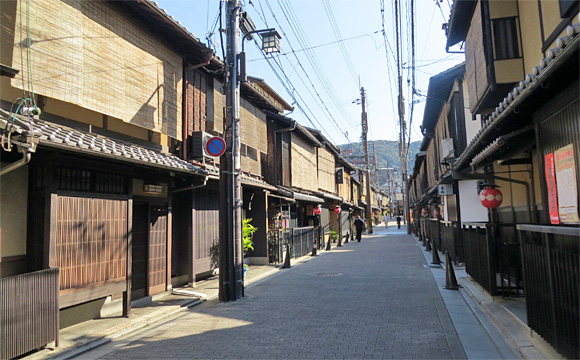
Identify the location of ledge. (121, 146).